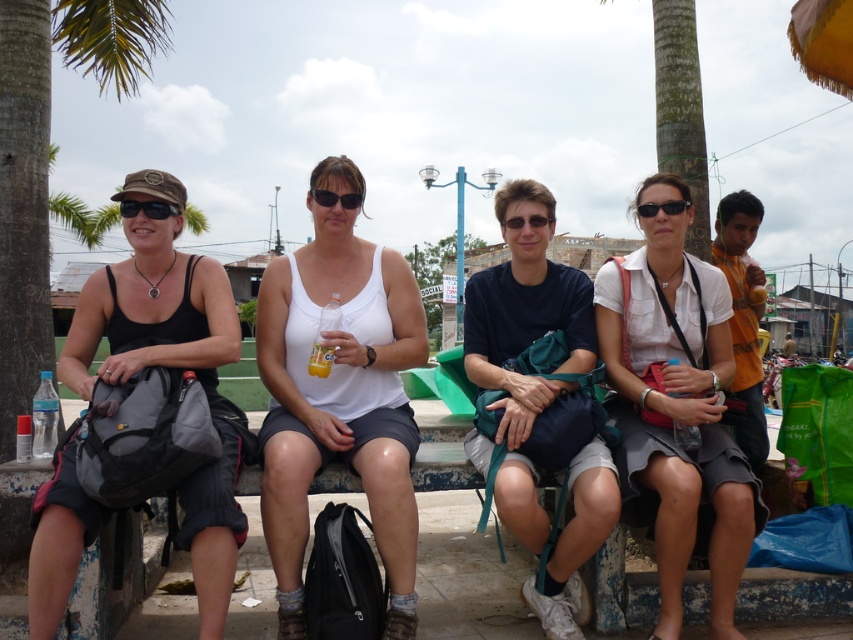
You are a photographer trying to capture the group of people sitting on the concrete bench. You want to ensure that the matte black sunglasses at left is in the center of your photo. Given the photo frame has a coordinate system where the bottom left corner is at point 0,0 and the top right corner is at 1,1, what are the coordinates of the center of the photo frame?

The center of the photo frame would be at coordinates (426,320). To position the matte black sunglasses at left at the center, you would need to adjust the camera so that the sunglasses are at (426,320). However, since the sunglasses are currently at (148,209), they are not centered.

Based on the photo, you are standing in front of the concrete bench where the group is sitting. There are two points marked on the bench. Which point is closer to you, point [642,212] or point [537,216]?

Point [642,212] is further to the viewer than point [537,216], so point [537,216] is closer to you.